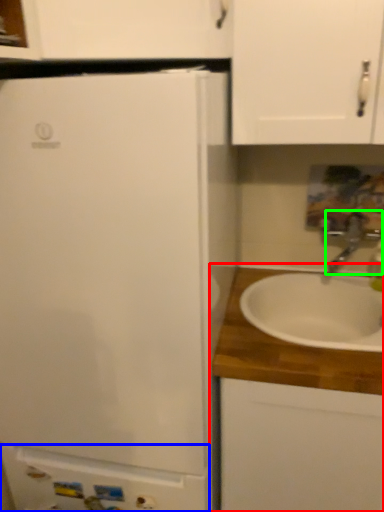
Question: Considering the real-world distances, which object is farthest from cabinetry (highlighted by a red box)? cabinetry (highlighted by a blue box) or tap (highlighted by a green box)?

Choices:
 (A) cabinetry
 (B) tap

Answer: (B)